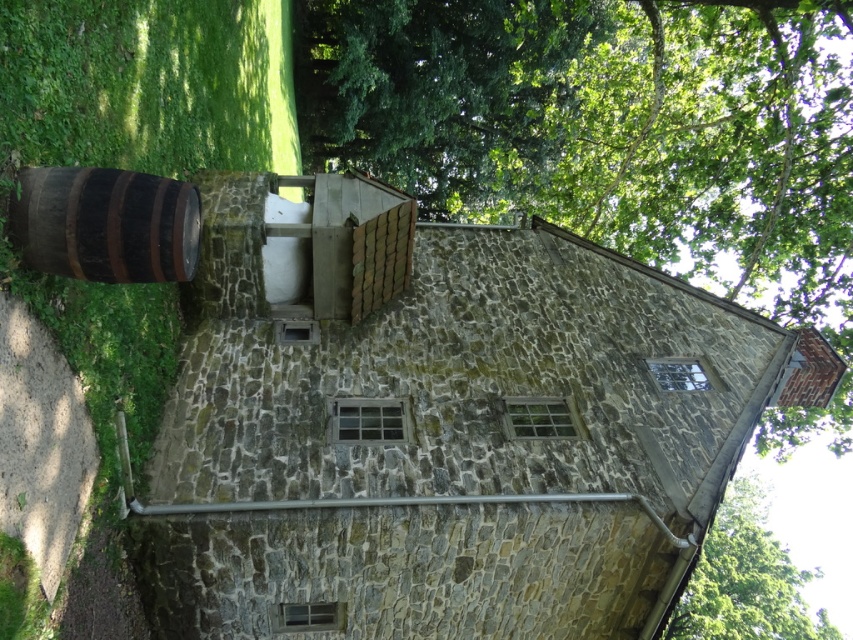
Does green leafy tree at center appear on the right side of brown wooden barrel at left?

Correct, you'll find green leafy tree at center to the right of brown wooden barrel at left.

Is green leafy tree at center to the left of brown wooden barrel at left from the viewer's perspective?

No, green leafy tree at center is not to the left of brown wooden barrel at left.

Is point (563, 96) farther from camera compared to point (0, 90)?

Yes, it is.

At what (x,y) coordinates should I click in order to perform the action: click on green leafy tree at center. Please return your answer as a coordinate pair (x, y). Looking at the image, I should click on (614, 136).

Does brown wooden barrel at left have a greater width compared to rustic wooden barrel at left?

No, brown wooden barrel at left is not wider than rustic wooden barrel at left.

Is brown wooden barrel at left thinner than rustic wooden barrel at left?

Yes, brown wooden barrel at left is thinner than rustic wooden barrel at left.

This screenshot has width=853, height=640. What do you see at coordinates (148, 84) in the screenshot?
I see `brown wooden barrel at left` at bounding box center [148, 84].

I want to click on brown wooden barrel at left, so click(x=148, y=84).

Is point (753, 116) positioned in front of point (757, 512)?

Yes, point (753, 116) is closer to viewer.

Is green leafy tree at center behind green leafy tree at upper right?

Yes, it is behind green leafy tree at upper right.

Describe the element at coordinates (614, 136) in the screenshot. I see `green leafy tree at center` at that location.

Locate an element on the screen. Image resolution: width=853 pixels, height=640 pixels. green leafy tree at center is located at coordinates (614, 136).